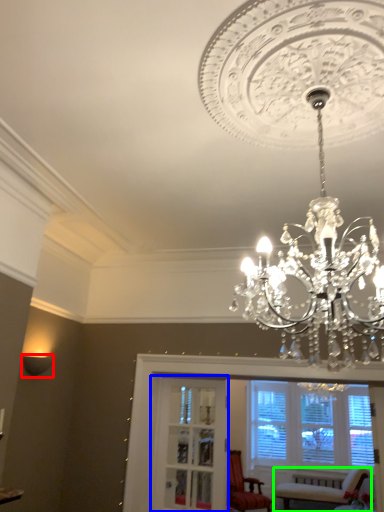
Question: Which object is the farthest from lamp (highlighted by a red box)? Choose among these: glass door (highlighted by a blue box) or chair (highlighted by a green box).

Choices:
 (A) glass door
 (B) chair

Answer: (B)